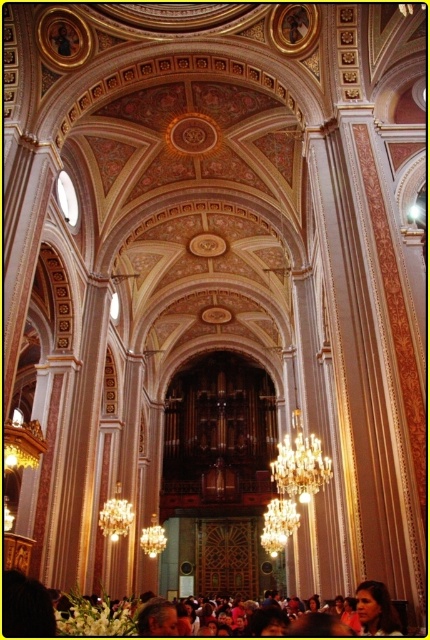
Locate an element on the screen. gold crystal chandelier at center is located at coordinates (300, 464).

Consider the image. Is gold crystal chandelier at center taller than smooth skin face at lower right?

Yes.

Identify the location of gold crystal chandelier at center. This screenshot has width=430, height=640. (300, 464).

The width and height of the screenshot is (430, 640). I want to click on gold crystal chandelier at center, so click(300, 464).